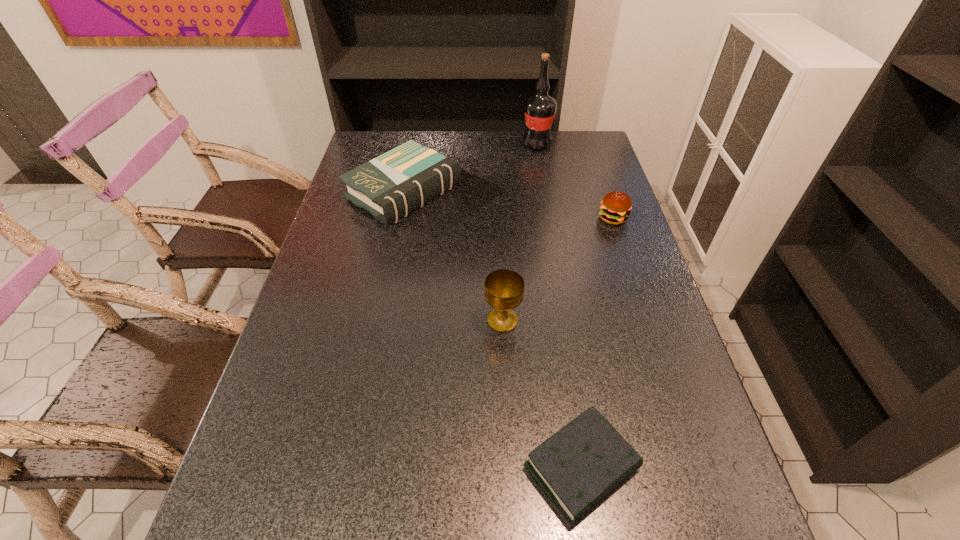
Find the location of `wine bottle`. wine bottle is located at coordinates (540, 109).

Where is `the farthest object`? the farthest object is located at coordinates (540, 109).

Locate an element on the screen. the fourth shortest object is located at coordinates (504, 289).

Identify the location of chalice. The image size is (960, 540). (504, 289).

Locate an element on the screen. The width and height of the screenshot is (960, 540). the leftmost object is located at coordinates (395, 183).

This screenshot has width=960, height=540. Find the location of `the rightmost object`. the rightmost object is located at coordinates (615, 208).

Where is `Bible`? The height and width of the screenshot is (540, 960). Bible is located at coordinates (577, 467).

Image resolution: width=960 pixels, height=540 pixels. I want to click on the shortest object, so click(577, 467).

Find the location of a particular element. The image size is (960, 540). vacant space located on the front of the tallest object is located at coordinates (540, 159).

Image resolution: width=960 pixels, height=540 pixels. Find the location of `vacant region located 0.380m on the back of the fourth farthest object`. vacant region located 0.380m on the back of the fourth farthest object is located at coordinates click(x=497, y=212).